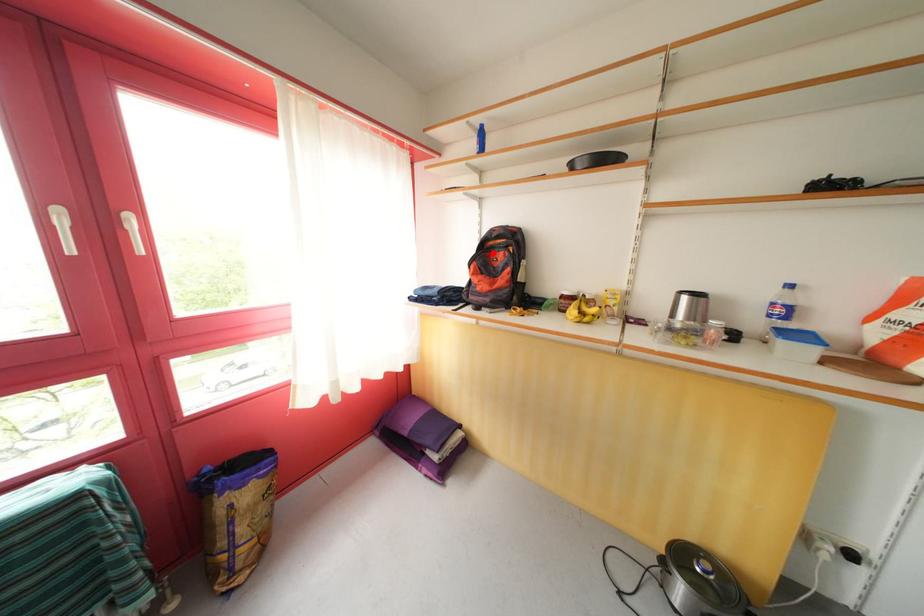
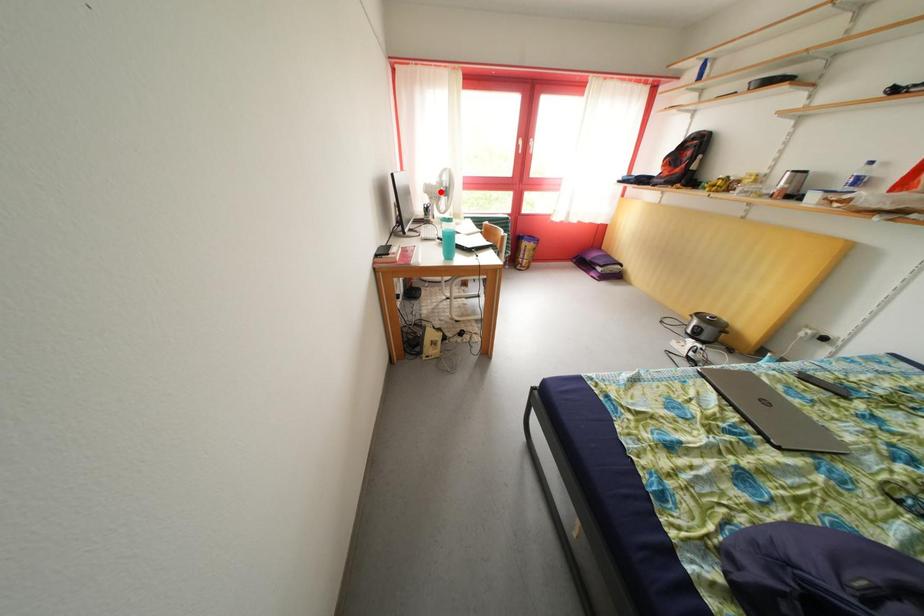
I am providing you with two images of the same scene from different viewpoints. A red point is marked on the first image and another point is marked on the second image. Do the highlighted points in image1 and image2 indicate the same real-world spot?

No